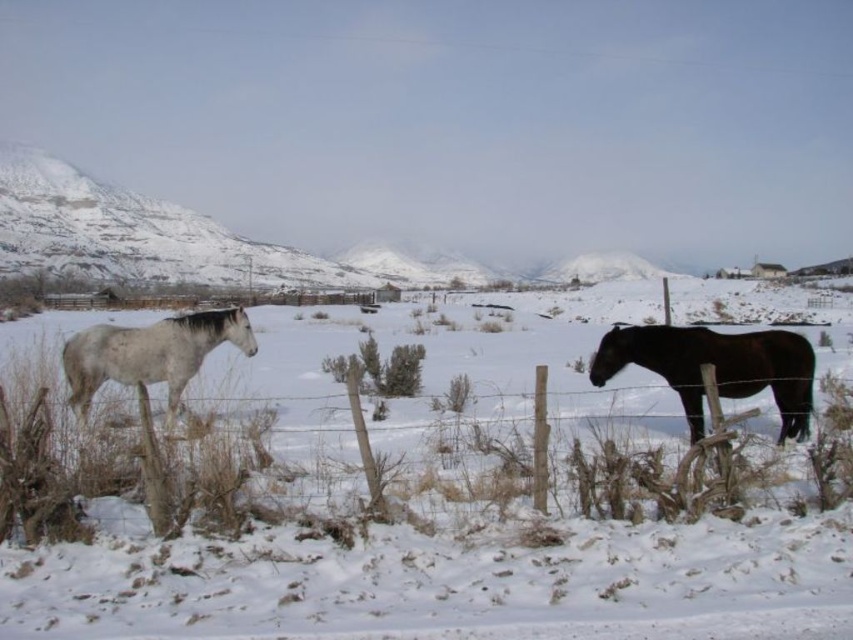
Which is above, white fluffy snow at center or white matte horse at left?

white fluffy snow at center is above.

Identify the location of white fluffy snow at center. (440, 509).

Which is behind, point (422, 593) or point (167, 384)?

The point (167, 384) is more distant.

The width and height of the screenshot is (853, 640). I want to click on white fluffy snow at center, so click(440, 509).

Does white fluffy snow at center have a lesser height compared to shiny dark brown horse at right?

In fact, white fluffy snow at center may be taller than shiny dark brown horse at right.

Can you confirm if white fluffy snow at center is taller than shiny dark brown horse at right?

Yes, white fluffy snow at center is taller than shiny dark brown horse at right.

At what (x,y) coordinates should I click in order to perform the action: click on white fluffy snow at center. Please return your answer as a coordinate pair (x, y). The width and height of the screenshot is (853, 640). Looking at the image, I should click on (440, 509).

Does wooden post fence at center have a smaller size compared to shiny dark brown horse at right?

Correct, wooden post fence at center occupies less space than shiny dark brown horse at right.

Find the location of a particular element. The height and width of the screenshot is (640, 853). wooden post fence at center is located at coordinates (120, 465).

In order to click on wooden post fence at center in this screenshot , I will do `click(120, 465)`.